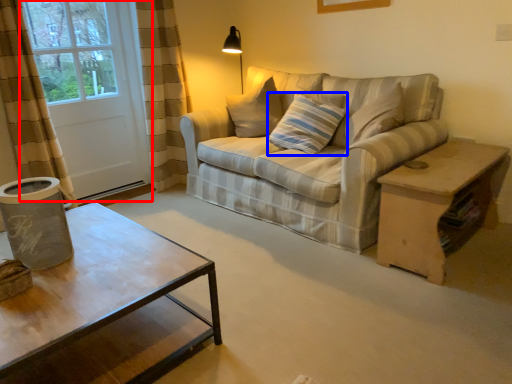
Question: Which point is further to the camera, screen door (highlighted by a red box) or pillow (highlighted by a blue box)?

Choices:
 (A) screen door
 (B) pillow

Answer: (A)